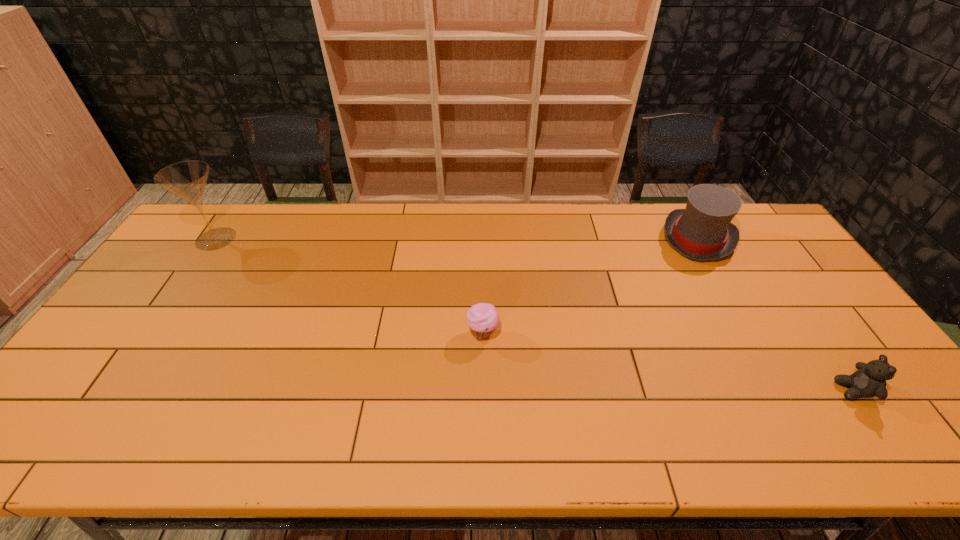
The width and height of the screenshot is (960, 540). What are the coordinates of `vacant space located 0.390m on the face of the teddy bear` in the screenshot? It's located at click(677, 390).

This screenshot has width=960, height=540. In order to click on vacant space located on the face of the teddy bear in this screenshot , I will do `click(742, 390)`.

Identify the location of vacant space situated 0.200m on the face of the teddy bear. The width and height of the screenshot is (960, 540). (755, 390).

The image size is (960, 540). Identify the location of free space located on the back of the second nearest object. (482, 237).

Image resolution: width=960 pixels, height=540 pixels. What are the coordinates of `flute glass present at the far edge` in the screenshot? It's located at (187, 179).

You are a GUI agent. You are given a task and a screenshot of the screen. Output one action in this format:
    pyautogui.click(x=<x>, y=<y>)
    Task: Click on the dress hat at the far edge
    Image resolution: width=960 pixels, height=540 pixels.
    Given the screenshot: What is the action you would take?
    pyautogui.click(x=703, y=231)

Locate an element on the screen. The image size is (960, 540). object located at the left edge is located at coordinates (187, 179).

Find the location of `dress hat that is at the right edge`. dress hat that is at the right edge is located at coordinates point(703,231).

Locate an element on the screen. The height and width of the screenshot is (540, 960). teddy bear that is at the right edge is located at coordinates (869, 380).

Locate an element on the screen. object at the far left corner is located at coordinates (187, 179).